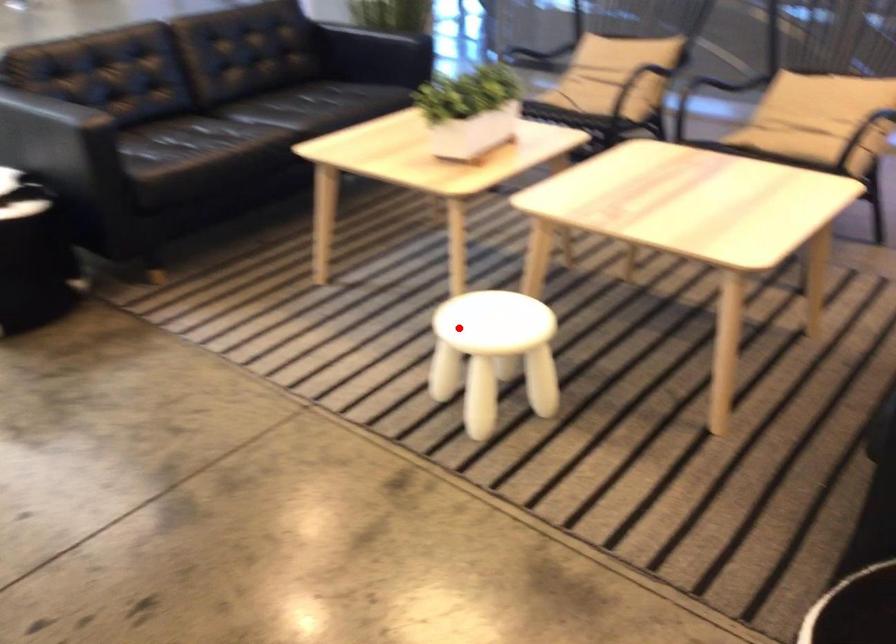
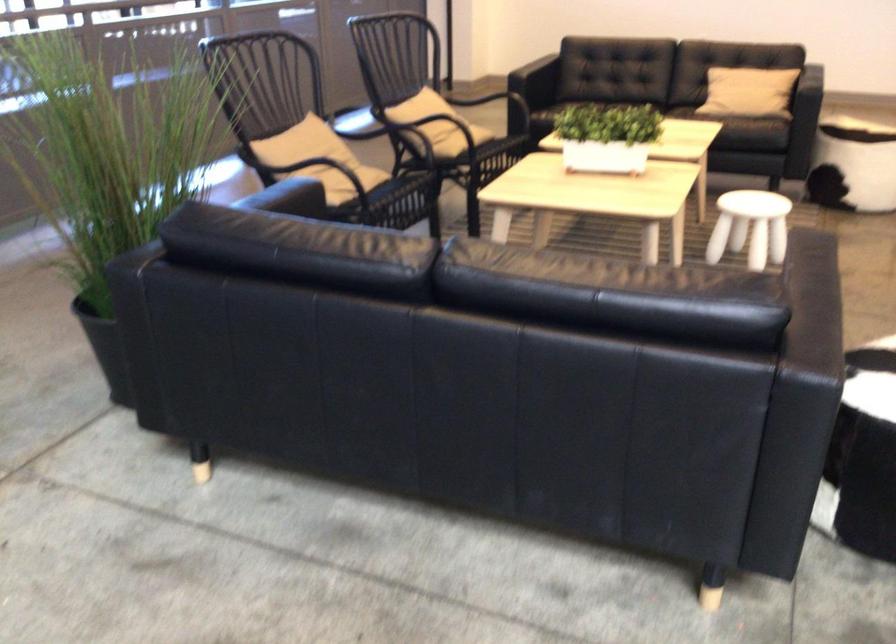
Question: I am providing you with two images of the same scene from different viewpoints. In image1, a red point is highlighted. Considering the same 3D point in image2, which of the following is correct?

Choices:
 (A) It is closer
 (B) It is farther

Answer: (B)